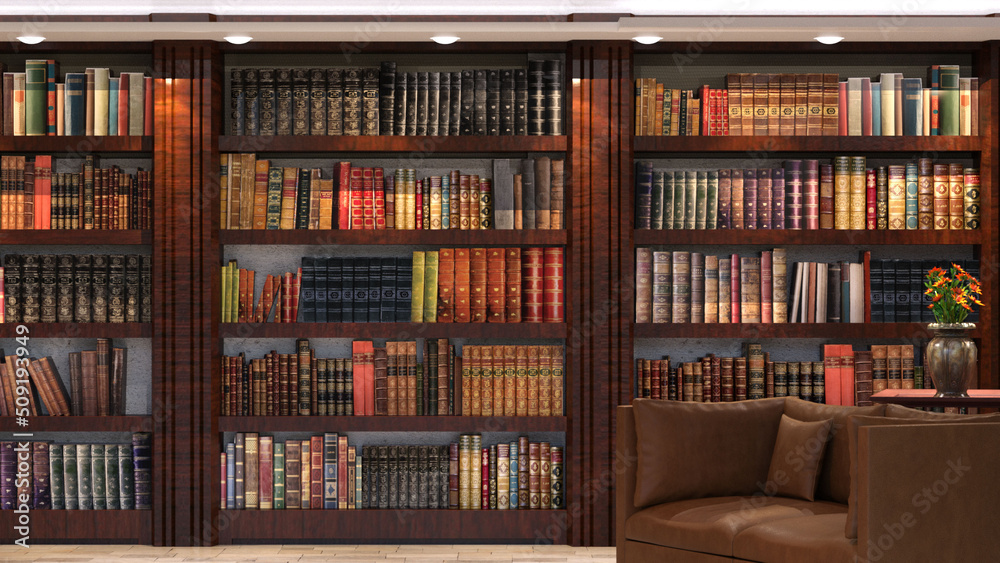
The height and width of the screenshot is (563, 1000). I want to click on books on bottom shelf of bookcase on left side, so click(x=141, y=475), click(x=124, y=482), click(x=110, y=494), click(x=98, y=499), click(x=86, y=501), click(x=68, y=499), click(x=56, y=499), click(x=44, y=497), click(x=8, y=499).